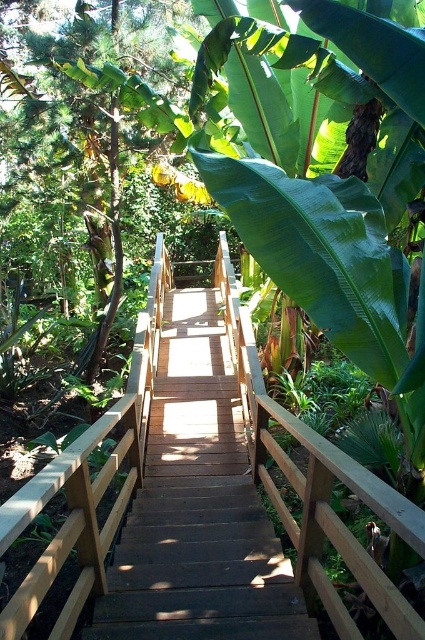
What do you see at coordinates (198, 508) in the screenshot?
I see `brown wooden stairs at center` at bounding box center [198, 508].

Is brown wooden stairs at center bigger than wooden bridge at center?

Correct, brown wooden stairs at center is larger in size than wooden bridge at center.

What do you see at coordinates (198, 508) in the screenshot? I see `brown wooden stairs at center` at bounding box center [198, 508].

Where is `brown wooden stairs at center`? This screenshot has height=640, width=425. brown wooden stairs at center is located at coordinates (x=198, y=508).